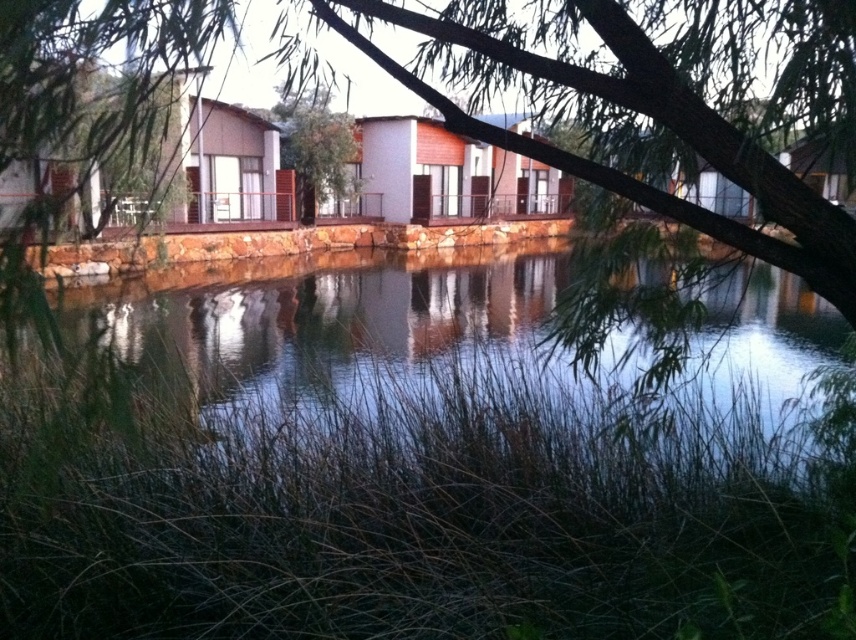
Question: Is green grassy river at center above green leafy tree at center?

Choices:
 (A) no
 (B) yes

Answer: (A)

Question: Can you confirm if green grassy river at center is positioned above green leafy tree at center?

Choices:
 (A) no
 (B) yes

Answer: (A)

Question: Is green grassy river at center wider than green leafy tree at center?

Choices:
 (A) no
 (B) yes

Answer: (B)

Question: Among these objects, which one is farthest from the camera?

Choices:
 (A) green grassy river at center
 (B) green leafy tree at center

Answer: (B)

Question: Which point is farther from the camera taking this photo?

Choices:
 (A) (394, 337)
 (B) (310, 157)

Answer: (B)

Question: Which point appears farthest from the camera in this image?

Choices:
 (A) (342, 189)
 (B) (562, 266)

Answer: (B)